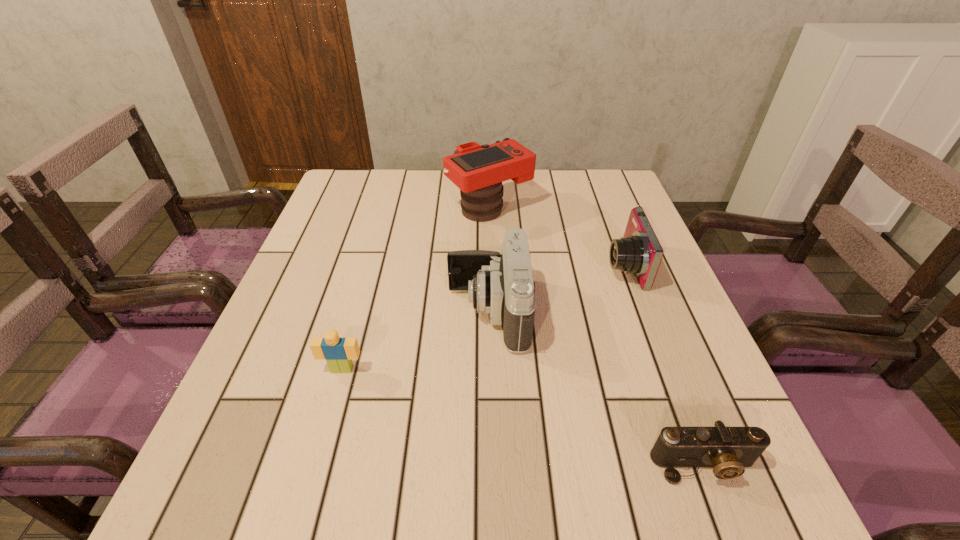
Identify the location of blank area located 0.190m on the face of the leftmost object. This screenshot has width=960, height=540. (312, 477).

Image resolution: width=960 pixels, height=540 pixels. In order to click on object located in the far edge section of the desktop in this screenshot , I will do `click(478, 171)`.

Image resolution: width=960 pixels, height=540 pixels. What are the coordinates of `object present at the near edge` in the screenshot? It's located at (728, 449).

Image resolution: width=960 pixels, height=540 pixels. I want to click on object present at the left edge, so click(339, 352).

Locate an element on the screen. The height and width of the screenshot is (540, 960). object that is at the near right corner is located at coordinates 728,449.

Identify the location of vacant area at the far edge. coord(412,193).

Where is `vacant space at the near edge`? vacant space at the near edge is located at coordinates (434, 485).

This screenshot has height=540, width=960. What are the coordinates of `vacant area at the left edge` in the screenshot? It's located at (336, 293).

Find the location of a particular element. free point at the right edge is located at coordinates (621, 294).

The height and width of the screenshot is (540, 960). In order to click on vacant space at the far left corner in this screenshot , I will do coord(383,202).